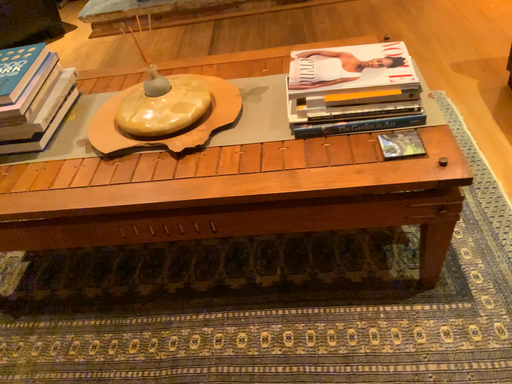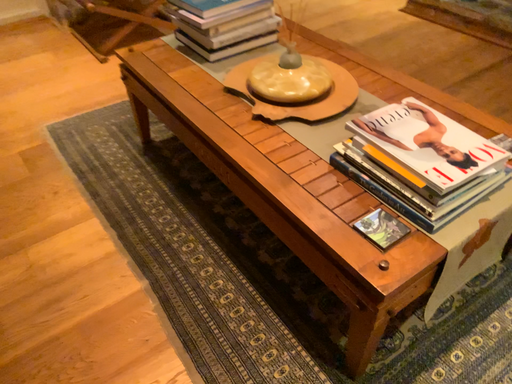
Question: How did the camera likely rotate when shooting the video?

Choices:
 (A) rotated downward
 (B) rotated upward

Answer: (B)